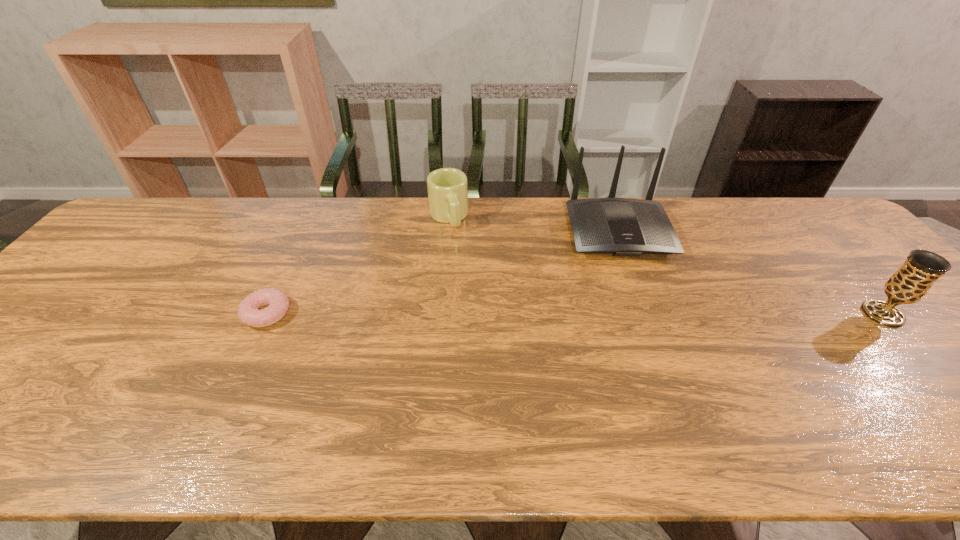
The image size is (960, 540). Find the location of `free spot between the shortest object and the third object from right to left`. free spot between the shortest object and the third object from right to left is located at coordinates (358, 265).

At what (x,y) coordinates should I click in order to perform the action: click on free space between the chalice and the second object from right to left. Please return your answer as a coordinate pair (x, y). Image resolution: width=960 pixels, height=540 pixels. Looking at the image, I should click on (750, 273).

Identify the location of vacant region between the second object from right to left and the doughnut. (442, 272).

At what (x,y) coordinates should I click in order to perform the action: click on object that is the closest one to the chalice. Please return your answer as a coordinate pair (x, y). Looking at the image, I should click on (620, 226).

The width and height of the screenshot is (960, 540). Identify the location of object that is the third nearest to the shortest object. (911, 282).

At what (x,y) coordinates should I click in order to perform the action: click on vacant point that satisfies the following two spatial constraints: 1. on the front side of the third object from right to left; 2. on the left side of the tallest object. Please return your answer as a coordinate pair (x, y). This screenshot has height=540, width=960. Looking at the image, I should click on (447, 231).